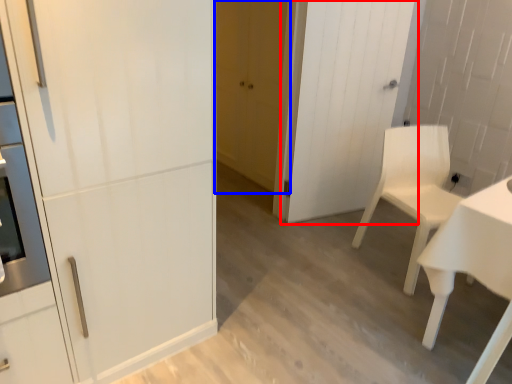
Question: Which point is further to the camera, door (highlighted by a red box) or door (highlighted by a blue box)?

Choices:
 (A) door
 (B) door

Answer: (B)